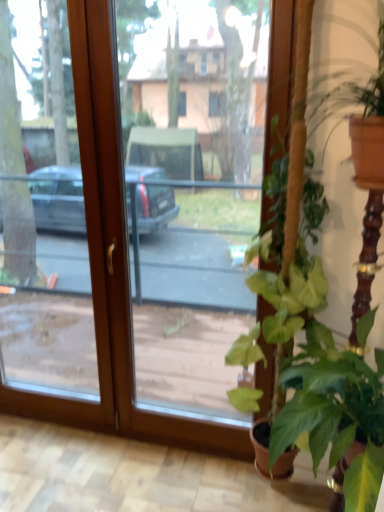
Question: From a real-world perspective, is green leafy plant at lower right, marked as the third houseplant in a top-to-bottom arrangement, physically below green leafy plant at right, acting as the first houseplant starting from the top?

Choices:
 (A) no
 (B) yes

Answer: (B)

Question: Considering the relative sizes of green leafy plant at lower right, which is the first houseplant in bottom-to-top order, and green leafy plant at right, which is the 3th houseplant from bottom to top, in the image provided, is green leafy plant at lower right, which is the first houseplant in bottom-to-top order, bigger than green leafy plant at right, which is the 3th houseplant from bottom to top,?

Choices:
 (A) yes
 (B) no

Answer: (A)

Question: Can you confirm if green leafy plant at lower right, marked as the third houseplant in a top-to-bottom arrangement, is smaller than green leafy plant at right, which is the 3th houseplant from bottom to top?

Choices:
 (A) yes
 (B) no

Answer: (B)

Question: Could you tell me if green leafy plant at lower right, which is the first houseplant in bottom-to-top order, is turned towards green leafy plant at right, which is the 3th houseplant from bottom to top?

Choices:
 (A) no
 (B) yes

Answer: (A)

Question: Considering the relative sizes of green leafy plant at lower right, marked as the third houseplant in a top-to-bottom arrangement, and green leafy plant at right, acting as the first houseplant starting from the top, in the image provided, is green leafy plant at lower right, marked as the third houseplant in a top-to-bottom arrangement, wider than green leafy plant at right, acting as the first houseplant starting from the top,?

Choices:
 (A) yes
 (B) no

Answer: (A)

Question: From a real-world perspective, relative to green leafy plant at lower right, which is the first houseplant in bottom-to-top order, is green leafy plant at right, acting as the first houseplant starting from the top, vertically above or below?

Choices:
 (A) below
 (B) above

Answer: (B)

Question: Is green leafy plant at right, which is the 3th houseplant from bottom to top, inside the boundaries of green leafy plant at lower right, marked as the third houseplant in a top-to-bottom arrangement, or outside?

Choices:
 (A) inside
 (B) outside

Answer: (B)

Question: Considering the relative positions of green leafy plant at right, acting as the first houseplant starting from the top, and green leafy plant at lower right, which is the first houseplant in bottom-to-top order, in the image provided, is green leafy plant at right, acting as the first houseplant starting from the top, to the left or to the right of green leafy plant at lower right, which is the first houseplant in bottom-to-top order,?

Choices:
 (A) right
 (B) left

Answer: (B)

Question: Considering the positions of green leafy plant at right, acting as the first houseplant starting from the top, and green leafy plant at lower right, which is the first houseplant in bottom-to-top order, in the image, is green leafy plant at right, acting as the first houseplant starting from the top, wider or thinner than green leafy plant at lower right, which is the first houseplant in bottom-to-top order,?

Choices:
 (A) thin
 (B) wide

Answer: (A)

Question: Considering the positions of green leafy plant at right, acting as the first houseplant starting from the top, and transparent glass door at center in the image, is green leafy plant at right, acting as the first houseplant starting from the top, wider or thinner than transparent glass door at center?

Choices:
 (A) wide
 (B) thin

Answer: (A)

Question: Considering their positions, is green leafy plant at right, which is the 3th houseplant from bottom to top, located in front of or behind transparent glass door at center?

Choices:
 (A) behind
 (B) front

Answer: (B)

Question: Is point (377, 65) positioned closer to the camera than point (86, 404)?

Choices:
 (A) closer
 (B) farther

Answer: (A)

Question: Visually, is green leafy plant at right, acting as the first houseplant starting from the top, positioned to the left or to the right of transparent glass door at center?

Choices:
 (A) left
 (B) right

Answer: (B)

Question: From the image's perspective, is green leafy plant at lower right, which is the first houseplant in bottom-to-top order, positioned above or below transparent glass door at center?

Choices:
 (A) below
 (B) above

Answer: (A)

Question: Is point (374, 451) positioned closer to the camera than point (92, 295)?

Choices:
 (A) farther
 (B) closer

Answer: (B)